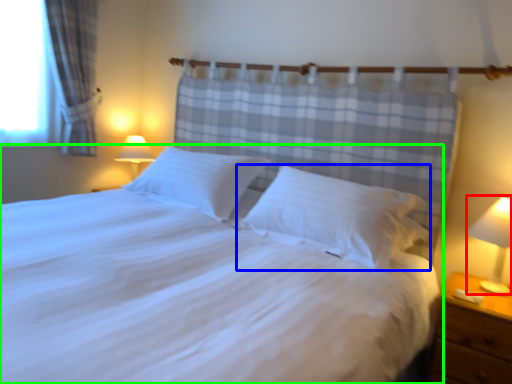
Question: Based on their relative distances, which object is farther from bedside lamp (highlighted by a red box)? Choose from pillow (highlighted by a blue box) and bed (highlighted by a green box).

Choices:
 (A) pillow
 (B) bed

Answer: (B)